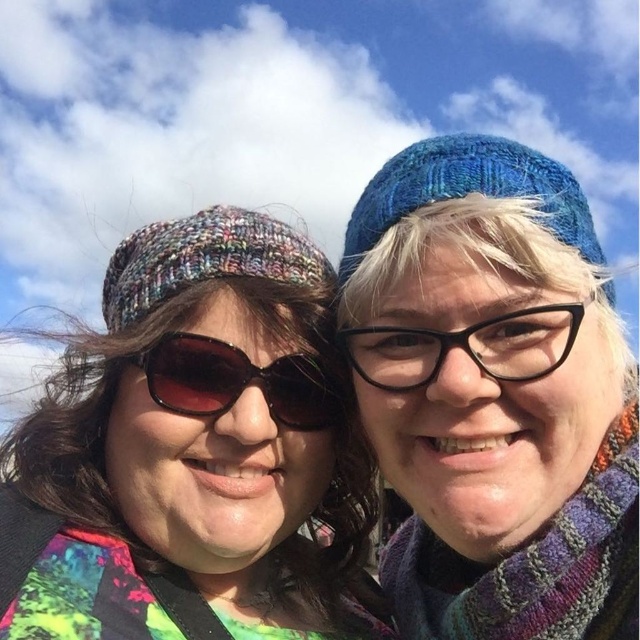
You are a photographer trying to capture a clear shot of the sunglasses at center. However, the multicolored knit hat at left is blocking your view. Can you adjust your position to avoid the obstruction?

The multicolored knit hat at left is in front of the sunglasses at center, so moving your position to the right or left might allow you to see around the hat and capture the sunglasses without obstruction.

You are a photographer trying to capture a clear shot of the black plastic glasses at center. However, the multicolored knitted beanie at left is blocking your view. Can you adjust your angle to see the glasses without moving either object?

The multicolored knitted beanie at left is positioned over the black plastic glasses at center, so adjusting your angle might allow you to see around or below the beanie to capture the glasses without moving either object.